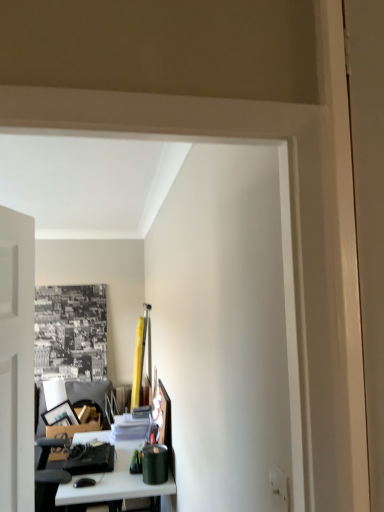
Question: Looking at the image, does white glossy table at lower left seem bigger or smaller compared to green matte canister at lower center, acting as the first stationery starting from the right?

Choices:
 (A) small
 (B) big

Answer: (B)

Question: Based on their positions, is white glossy table at lower left located to the left or right of green matte canister at lower center, the first stationery from the front?

Choices:
 (A) left
 (B) right

Answer: (A)

Question: Based on their relative distances, which object is farther from the green matte canister at lower center, which is the second stationery from back to front?

Choices:
 (A) matte black stationery at lower left, arranged as the 1th stationery when viewed from the left
 (B) white glossy table at lower left

Answer: (A)

Question: Based on their relative distances, which object is nearer to the green matte canister at lower center, which is the second stationery from back to front?

Choices:
 (A) matte black stationery at lower left, which is the 2th stationery in right-to-left order
 (B) white glossy table at lower left

Answer: (B)